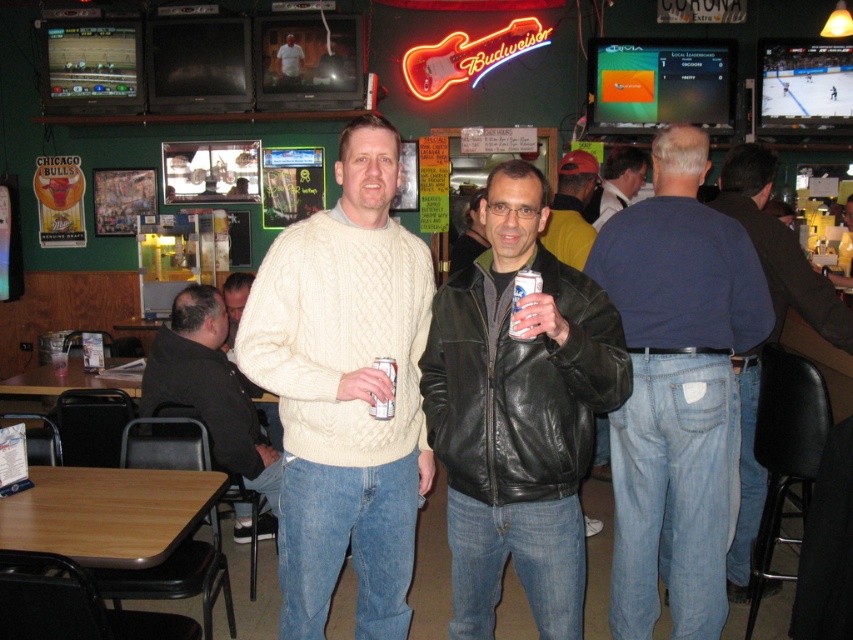
What is located at the coordinates point (518,412)?

The black leather jacket at center is located at point (518,412).

From the picture: You are a photographer trying to capture a candid shot of the blue cotton shirt at back and the matte black jacket at center. Based on their positions, which one should you focus on first to ensure both are in frame?

The blue cotton shirt at back is to the left of the matte black jacket at center, so you should focus on the blue cotton shirt at back first to ensure both are in frame.

You are a photographer trying to capture a group photo of the blue cotton shirt at back and the matte black jacket at center. If you want to make both subjects appear the same size in the photo, what should you do?

To make the blue cotton shirt at back and the matte black jacket at center appear the same size in the photo, move closer to the matte black jacket at center since it is smaller than the blue cotton shirt at back.